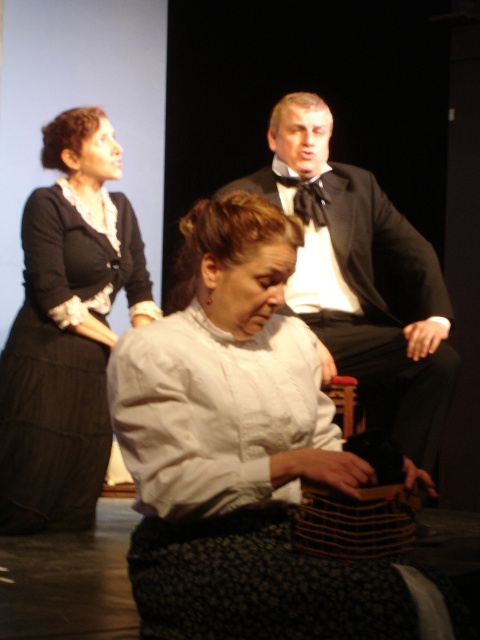
Question: Which of the following is the farthest from the observer?

Choices:
 (A) (423, 280)
 (B) (317, 211)

Answer: (B)

Question: Can you confirm if white cotton blouse at center is wider than matte black dress at left?

Choices:
 (A) yes
 (B) no

Answer: (A)

Question: Where is black satin tuxedo at upper center located in relation to black satin bow tie at upper center in the image?

Choices:
 (A) left
 (B) right

Answer: (B)

Question: Can you confirm if white cotton blouse at center is positioned to the right of matte black dress at left?

Choices:
 (A) no
 (B) yes

Answer: (B)

Question: Which point is closer to the camera?

Choices:
 (A) (323, 604)
 (B) (96, 413)

Answer: (A)

Question: Among these objects, which one is farthest from the camera?

Choices:
 (A) matte black dress at left
 (B) white cotton blouse at center
 (C) black satin bow tie at upper center
 (D) black satin tuxedo at upper center

Answer: (A)